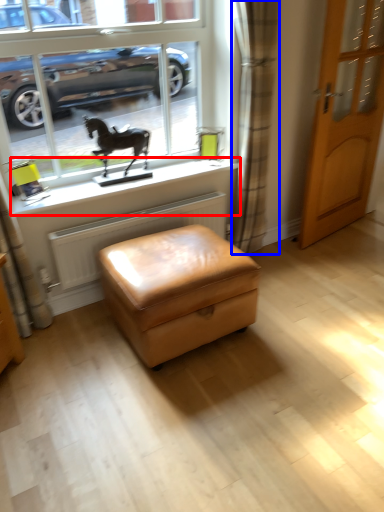
Question: Which object is further to the camera taking this photo, window sill (highlighted by a red box) or curtain (highlighted by a blue box)?

Choices:
 (A) window sill
 (B) curtain

Answer: (A)